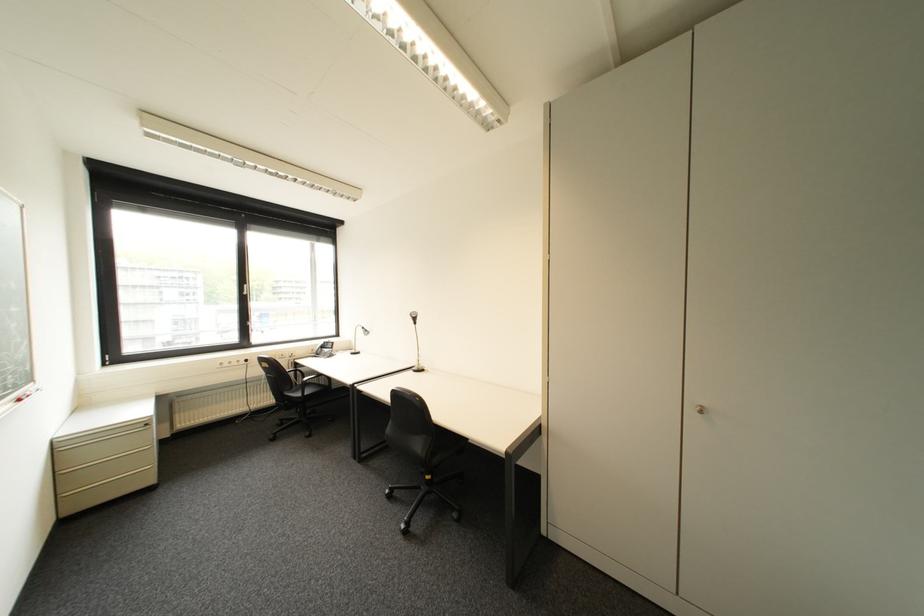
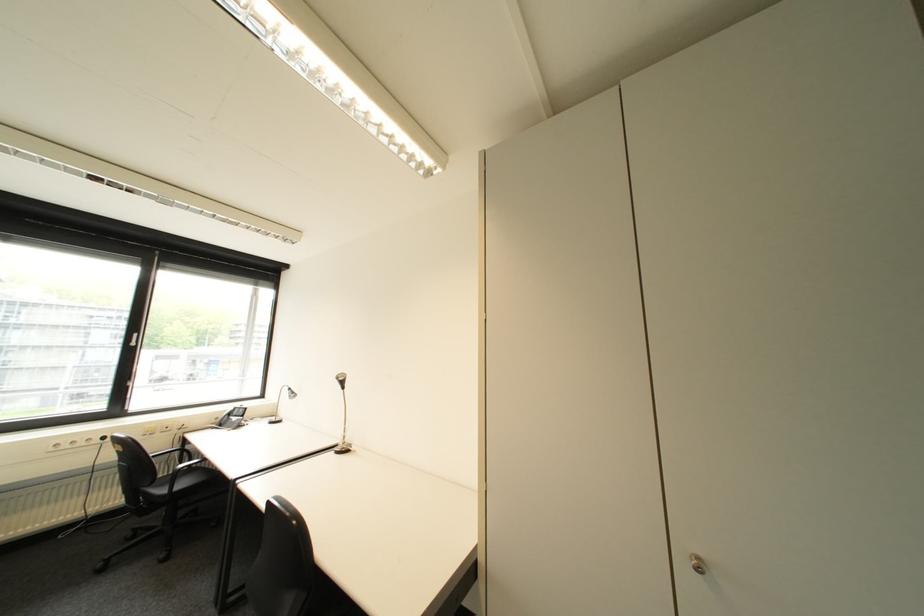
Locate, in the second image, the point that corresponds to [423,369] in the first image.

(346, 450)